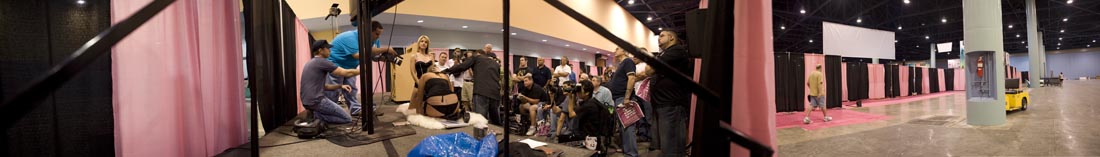
Where is `bar`? The image size is (1100, 157). bar is located at coordinates (100, 47).